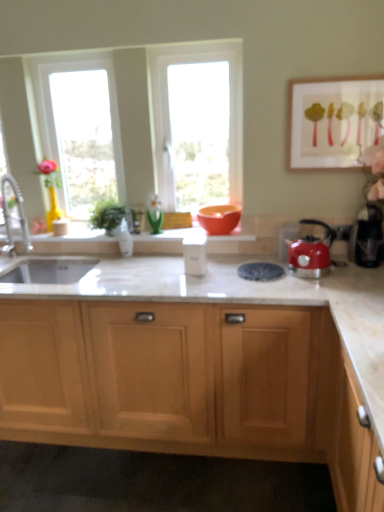
This screenshot has height=512, width=384. Describe the element at coordinates (367, 238) in the screenshot. I see `black plastic coffee machine at right` at that location.

Where is `red glossy kettle at right`? The width and height of the screenshot is (384, 512). red glossy kettle at right is located at coordinates (311, 252).

Identify the location of coffee machine below the wooden framed artwork at upper right (from a real-world perspective). The height and width of the screenshot is (512, 384). (367, 238).

Who is taller, black plastic coffee machine at right or wooden framed artwork at upper right?

With more height is wooden framed artwork at upper right.

Considering the relative sizes of black plastic coffee machine at right and wooden framed artwork at upper right in the image provided, is black plastic coffee machine at right bigger than wooden framed artwork at upper right?

Indeed, black plastic coffee machine at right has a larger size compared to wooden framed artwork at upper right.

Is white marble window sill at center at the back of light wood cabinet at center?

No, light wood cabinet at center is not facing away from white marble window sill at center.

Is light wood cabinet at center closer to camera compared to white marble window sill at center?

Yes, it is.

Considering the sizes of objects light wood cabinet at center and white marble window sill at center in the image provided, who is shorter, light wood cabinet at center or white marble window sill at center?

With less height is white marble window sill at center.

How distant is white marble window sill at center from wooden framed artwork at upper right?

white marble window sill at center is 71.74 centimeters away from wooden framed artwork at upper right.

Does white marble window sill at center appear on the right side of wooden framed artwork at upper right?

No.

From the image's perspective, which is below, white marble window sill at center or wooden framed artwork at upper right?

white marble window sill at center.

Considering the sizes of white marble window sill at center and wooden framed artwork at upper right in the image, is white marble window sill at center wider or thinner than wooden framed artwork at upper right?

Clearly, white marble window sill at center has more width compared to wooden framed artwork at upper right.

From a real-world perspective, who is located lower, white glossy container at center or clear glass window at center, which appears as the 1th window when viewed from the left?

In real-world perspective, white glossy container at center is lower.

Is white glossy container at center far from clear glass window at center, which appears as the 1th window when viewed from the left?

white glossy container at center is near clear glass window at center, which appears as the 1th window when viewed from the left, not far away.

In terms of size, does white glossy container at center appear bigger or smaller than clear glass window at center, which appears as the 1th window when viewed from the left?

white glossy container at center is smaller than clear glass window at center, which appears as the 1th window when viewed from the left.

Based on the photo, considering the sizes of white glossy container at center and clear glass window at center, which ranks as the second window in right-to-left order, in the image, is white glossy container at center wider or thinner than clear glass window at center, which ranks as the second window in right-to-left order,?

Considering their sizes, white glossy container at center looks slimmer than clear glass window at center, which ranks as the second window in right-to-left order.

Find the location of `flowerpot below the green leafy plant at center (from the image's perspective)`. flowerpot below the green leafy plant at center (from the image's perspective) is located at coordinates coord(219,218).

Does matte orange bowl at center touch green leafy plant at center?

matte orange bowl at center and green leafy plant at center are not in contact.

Considering the relative positions of matte orange bowl at center and green leafy plant at center in the image provided, is matte orange bowl at center behind green leafy plant at center?

No.

Is matte orange bowl at center turned away from green leafy plant at center?

No, matte orange bowl at center's orientation is not away from green leafy plant at center.

In terms of height, does white glossy container at center look taller or shorter compared to green glass vase at center, which appears as the second glass vase when viewed from the left?

In the image, white glossy container at center appears to be taller than green glass vase at center, which appears as the second glass vase when viewed from the left.

Who is smaller, white glossy container at center or green glass vase at center, which appears as the second glass vase when viewed from the left?

Smaller between the two is green glass vase at center, which appears as the second glass vase when viewed from the left.

Does white glossy container at center lie behind green glass vase at center, which appears as the second glass vase when viewed from the left?

No, white glossy container at center is closer to the camera.

Between white glossy container at center and green glass vase at center, which appears as the second glass vase when viewed from the left, which one has smaller width?

green glass vase at center, which appears as the second glass vase when viewed from the left.

In the scene shown: From a real-world perspective, is white marble window sill at center physically located above or below green leafy plant at center?

white marble window sill at center is below green leafy plant at center.

Considering the positions of objects white marble window sill at center and green leafy plant at center in the image provided, who is behind, white marble window sill at center or green leafy plant at center?

Positioned behind is green leafy plant at center.

I want to click on window sill lying on the right of green leafy plant at center, so click(75, 236).

Is white marble window sill at center completely or partially outside of green leafy plant at center?

That's correct, white marble window sill at center is outside of green leafy plant at center.

This screenshot has height=512, width=384. I want to click on coffee machine that is below the wooden framed artwork at upper right (from the image's perspective), so coord(367,238).

You are a GUI agent. You are given a task and a screenshot of the screen. Output one action in this format:
    pyautogui.click(x=<x>, y=<y>)
    Task: Click on the window sill that is above the light wood cabinet at center (from a real-world perspective)
    
    Given the screenshot: What is the action you would take?
    pyautogui.click(x=75, y=236)

Based on their spatial positions, is black plastic coffee machine at right or brushed metal faucet at left closer to matte orange bowl at center?

Among the two, black plastic coffee machine at right is located nearer to matte orange bowl at center.

Looking at the image, which one is located closer to matte orange bowl at center, clear glass window at center, which appears as the 1th window when viewed from the left, or transparent glass window at center, positioned as the 2th window in left-to-right order?

transparent glass window at center, positioned as the 2th window in left-to-right order, lies closer to matte orange bowl at center than the other object.

Considering their positions, is white glossy container at center positioned further to transparent glass window at center, which ranks as the 1th window in right-to-left order, than clear glass vase at center, the 1th glass vase positioned from the left?

Based on the image, clear glass vase at center, the 1th glass vase positioned from the left, appears to be further to transparent glass window at center, which ranks as the 1th window in right-to-left order.

Looking at the image, which one is located closer to white marble window sill at center, wooden framed artwork at upper right or clear glass vase at center, which is the 2th glass vase from right to left?

clear glass vase at center, which is the 2th glass vase from right to left, is positioned closer to the anchor white marble window sill at center.

Looking at this image, which object lies further to the anchor point black plastic coffee machine at right, matte orange bowl at center or green leafy plant at center?

green leafy plant at center is positioned further to the anchor black plastic coffee machine at right.

Looking at the image, which one is located further to black plastic coffee machine at right, brushed metal faucet at left or white marble window sill at center?

Based on the image, brushed metal faucet at left appears to be further to black plastic coffee machine at right.

Consider the image. Considering their positions, is green leafy plant at center positioned further to clear glass vase at center, which is the 2th glass vase from right to left, than white glossy container at center?

white glossy container at center.

Estimate the real-world distances between objects in this image. Which object is closer to clear glass window at center, which appears as the 1th window when viewed from the left, clear glass vase at center, the 1th glass vase positioned from the left, or matte orange bowl at center?

clear glass vase at center, the 1th glass vase positioned from the left, is closer to clear glass window at center, which appears as the 1th window when viewed from the left.

Where is `appliance between matte orange bowl at center and light wood cabinet at center vertically`? Image resolution: width=384 pixels, height=512 pixels. appliance between matte orange bowl at center and light wood cabinet at center vertically is located at coordinates (195, 252).

The height and width of the screenshot is (512, 384). I want to click on appliance located between brushed metal faucet at left and wooden framed artwork at upper right in the left-right direction, so click(195, 252).

Where is `flowerpot between light wood cabinet at center and black plastic coffee machine at right in the horizontal direction`? flowerpot between light wood cabinet at center and black plastic coffee machine at right in the horizontal direction is located at coordinates (219, 218).

Locate an element on the screen. Image resolution: width=384 pixels, height=512 pixels. flowerpot between clear glass vase at center, the 1th glass vase positioned from the left, and black plastic coffee machine at right is located at coordinates (219, 218).